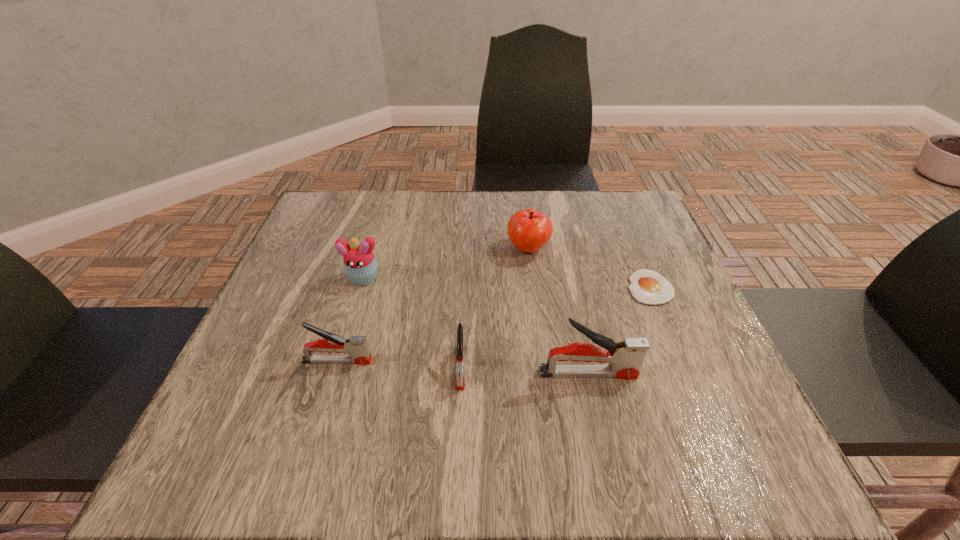
Please show where to add a stapler on the right while keeping spacing even. Please provide its 2D coordinates. Your answer should be formatted as a tuple, i.e. [(x, y)], where the tuple contains the x and y coordinates of a point satisfying the conditions above.

[(718, 380)]